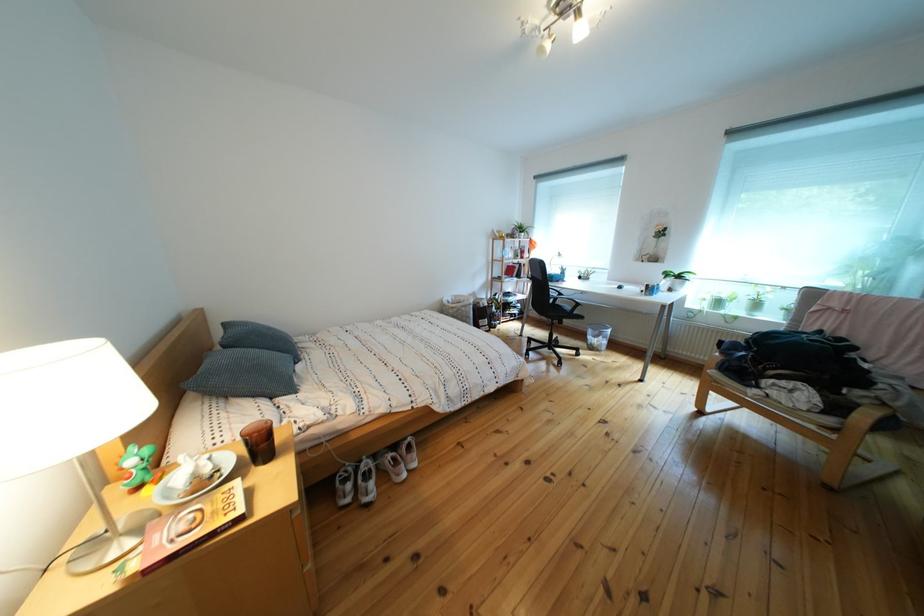
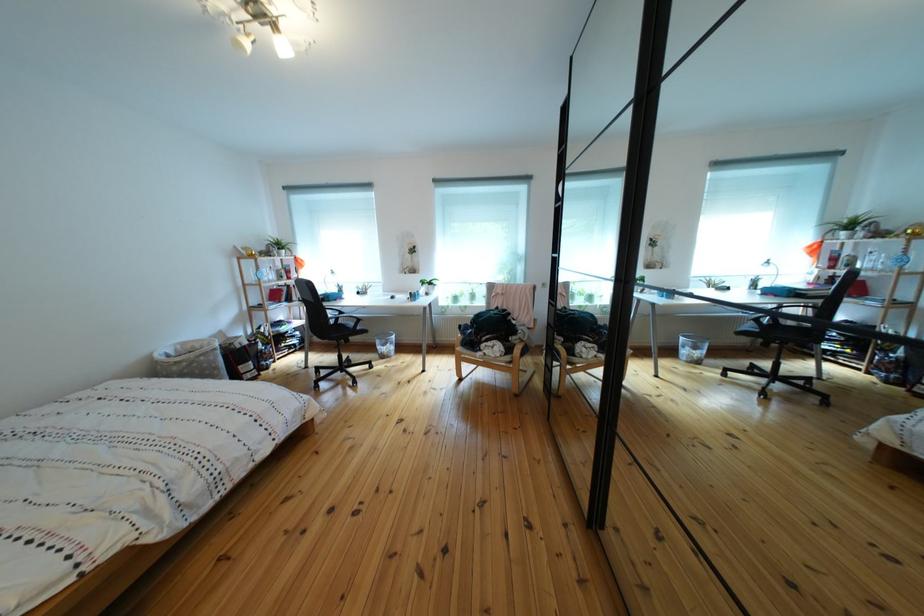
Locate, in the second image, the point that corresponds to point 562,290 in the first image.

(336, 310)